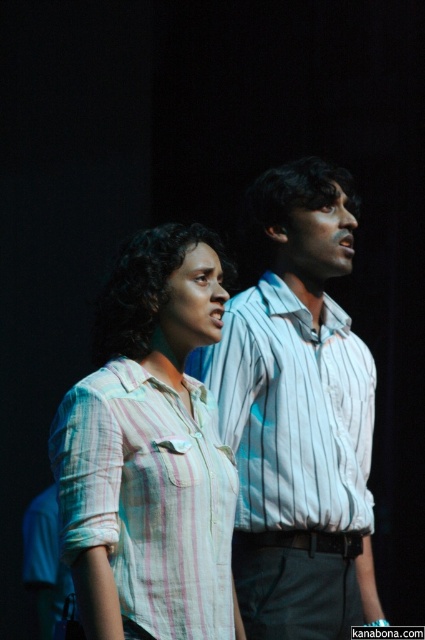
In the scene shown: Can you confirm if white striped shirt at center is shorter than light pink striped shirt at center?

Incorrect, white striped shirt at center's height does not fall short of light pink striped shirt at center's.

Does white striped shirt at center lie in front of light pink striped shirt at center?

No, white striped shirt at center is behind light pink striped shirt at center.

Does point (232, 308) come in front of point (164, 234)?

That is False.

Where is `white striped shirt at center`? The height and width of the screenshot is (640, 425). white striped shirt at center is located at coordinates (299, 416).